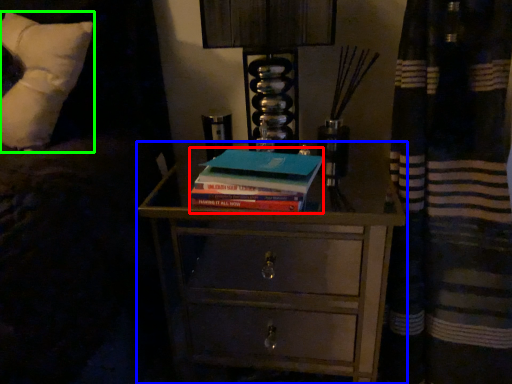
Question: Which object is positioned closest to paperback book (highlighted by a red box)? Select from chest of drawers (highlighted by a blue box) and pillow (highlighted by a green box).

Choices:
 (A) chest of drawers
 (B) pillow

Answer: (B)